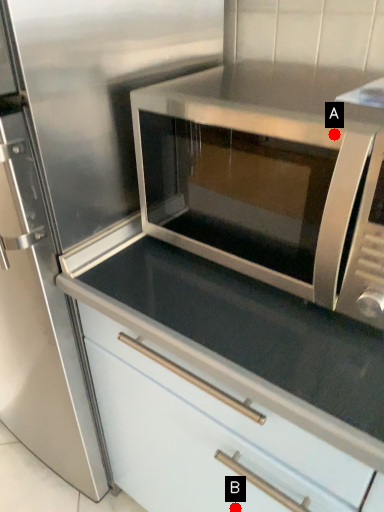
Question: Two points are circled on the image, labeled by A and B beside each circle. Which of the following is the farthest from the observer?

Choices:
 (A) A is further
 (B) B is further

Answer: (B)